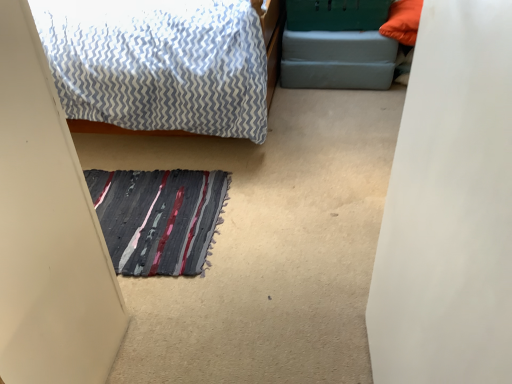
Image resolution: width=512 pixels, height=384 pixels. In order to click on free point in front of green plastic bed frame at upper center in this screenshot , I will do `click(338, 104)`.